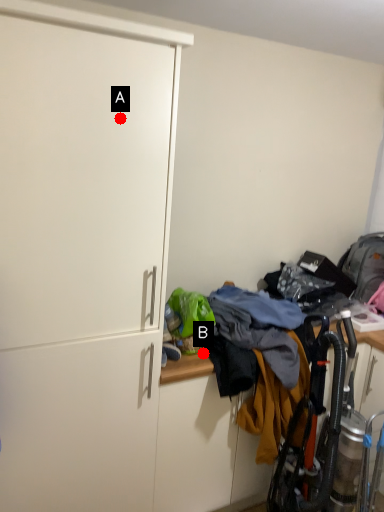
Question: Two points are circled on the image, labeled by A and B beside each circle. Which point is closer to the camera?

Choices:
 (A) A is closer
 (B) B is closer

Answer: (A)